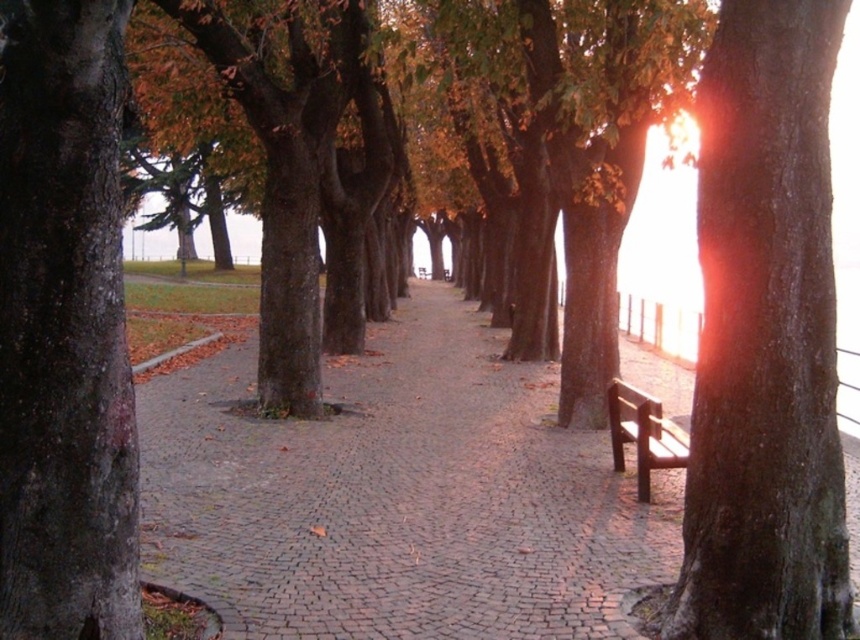
You are a gardener planning to place a 2m wide decorative stone archway along the pathway. Given the scene, which object between the cobblestone pavement at center and the smooth brown bark at right would be suitable for placing the archway without obstructing the path?

The cobblestone pavement at center has a larger width than the smooth brown bark at right, so placing the 2m wide decorative stone archway on the cobblestone pavement at center would be suitable as it has enough space without obstructing the path.

You are a person standing at the start of the pathway and want to sit down. The cobblestone pavement at center and the brown wooden bench at right are both visible. Which one is lower in position?

The cobblestone pavement at center is located below brown wooden bench at right, so the cobblestone pavement at center is lower in position.